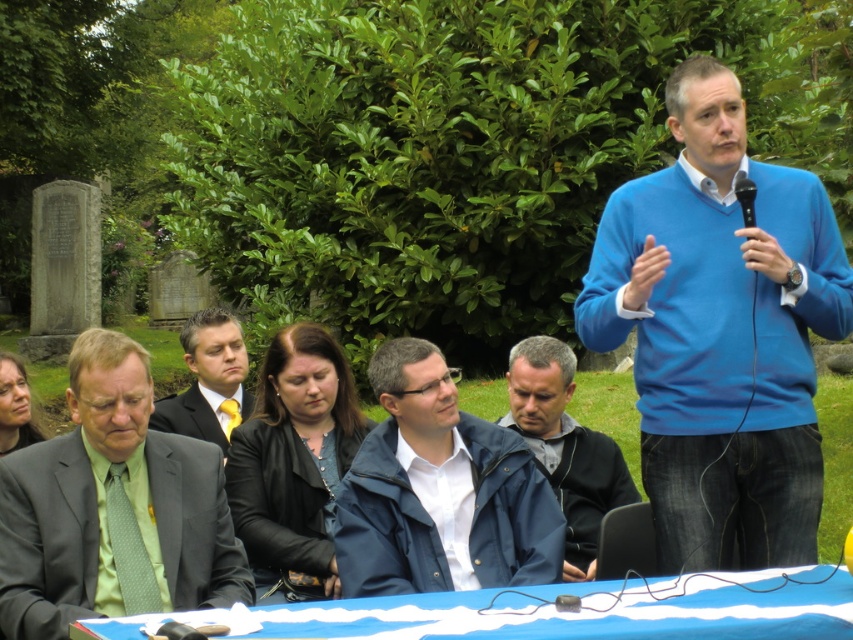
Question: Which point appears farthest from the camera in this image?

Choices:
 (A) (252, 401)
 (B) (567, 349)
 (C) (659, 298)
 (D) (440, 529)

Answer: (A)

Question: Which point is farther to the camera?

Choices:
 (A) (694, 522)
 (B) (287, 387)
 (C) (573, 356)

Answer: (C)

Question: Is blue fabric jacket at center closer to the viewer compared to blue fabric table at lower center?

Choices:
 (A) no
 (B) yes

Answer: (A)

Question: From the image, what is the correct spatial relationship of green silk tie at left in relation to dark suit at center?

Choices:
 (A) right
 (B) left

Answer: (A)

Question: Among these points, which one is nearest to the camera?

Choices:
 (A) (563, 356)
 (B) (670, 177)
 (C) (276, 490)

Answer: (B)

Question: Does black leather jacket at center appear on the left side of blue matte jacket at center?

Choices:
 (A) no
 (B) yes

Answer: (B)